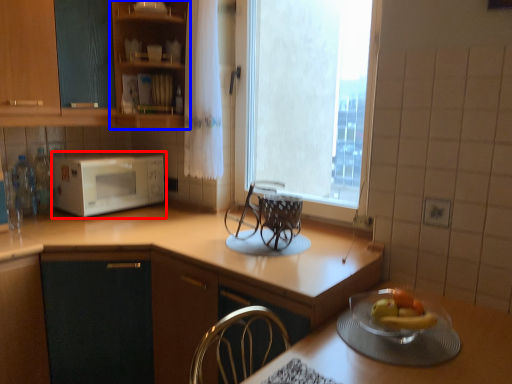
Question: Among these objects, which one is nearest to the camera, microwave oven (highlighted by a red box) or cabinetry (highlighted by a blue box)?

Choices:
 (A) microwave oven
 (B) cabinetry

Answer: (B)